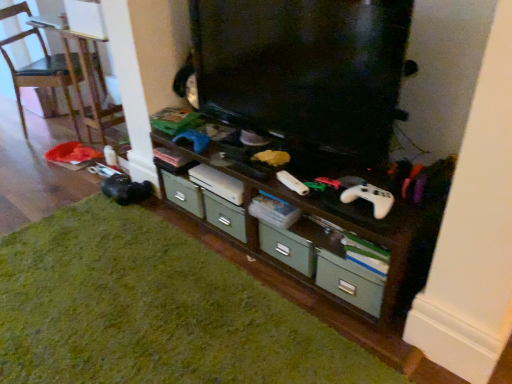
Where is `blank space situated above green matte hardwood at lower left (from a real-world perspective)`? blank space situated above green matte hardwood at lower left (from a real-world perspective) is located at coordinates (134, 295).